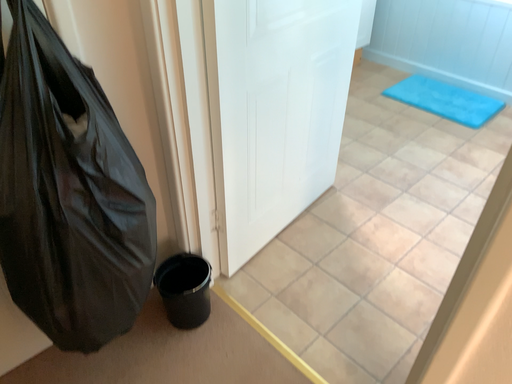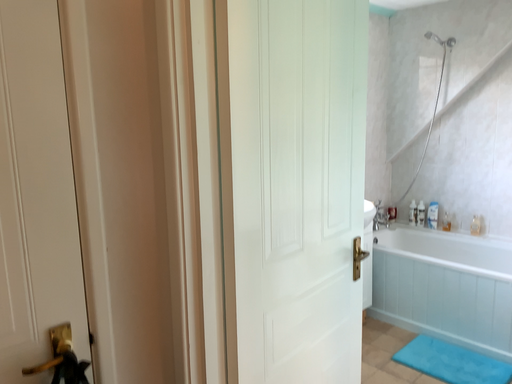
Question: How did the camera likely rotate when shooting the video?

Choices:
 (A) rotated upward
 (B) rotated downward

Answer: (A)